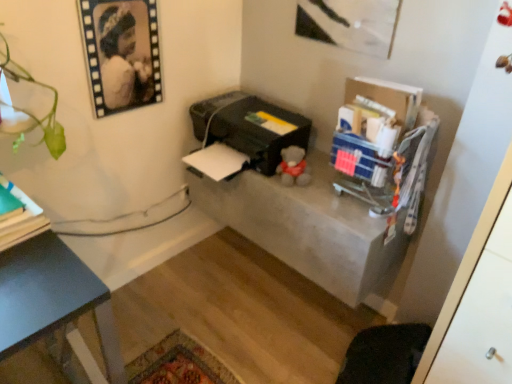
Question: In terms of size, does green matte book at left appear bigger or smaller than black matte portrait at upper left?

Choices:
 (A) big
 (B) small

Answer: (A)

Question: Considering the relative positions of green matte book at left and black matte portrait at upper left in the image provided, is green matte book at left to the left or to the right of black matte portrait at upper left?

Choices:
 (A) right
 (B) left

Answer: (B)

Question: Estimate the real-world distances between objects in this image. Which object is farther from the black plastic printer at center?

Choices:
 (A) green matte book at left
 (B) concrete table at center
 (C) black matte portrait at upper left

Answer: (A)

Question: Which object is the farthest from the black matte portrait at upper left?

Choices:
 (A) green matte book at left
 (B) concrete table at center
 (C) black plastic printer at center

Answer: (B)